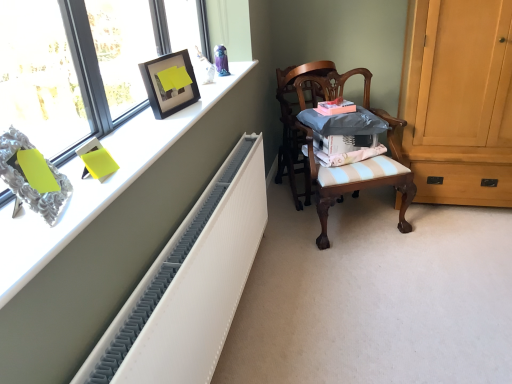
I want to click on matte glass window at upper left, so click(x=108, y=58).

This screenshot has height=384, width=512. What are the coordinates of `wooden chair at center, the 1th chair from the back` in the screenshot? It's located at (305, 108).

You are a GUI agent. You are given a task and a screenshot of the screen. Output one action in this format:
    pyautogui.click(x=<x>, y=<y>)
    Task: Click on the matte glass window at upper left
    
    Given the screenshot: What is the action you would take?
    (x=108, y=58)

Is matte black picture frame at upper left taller than wooden chair at center, placed as the 1th chair when sorted from front to back?

No.

Which object is closer to the camera, matte black picture frame at upper left or wooden chair at center, placed as the 1th chair when sorted from front to back?

matte black picture frame at upper left is in front.

Is matte black picture frame at upper left oriented away from wooden chair at center, placed as the 2th chair when sorted from back to front?

No, matte black picture frame at upper left is not facing away from wooden chair at center, placed as the 2th chair when sorted from back to front.

Considering the relative positions of matte black picture frame at upper left and wooden chair at center, placed as the 1th chair when sorted from front to back, in the image provided, is matte black picture frame at upper left to the right of wooden chair at center, placed as the 1th chair when sorted from front to back, from the viewer's perspective?

No.

Is white textured radiator at left smaller than light brown wood cabinet at right?

Yes, white textured radiator at left is smaller than light brown wood cabinet at right.

Between white textured radiator at left and light brown wood cabinet at right, which one appears on the right side from the viewer's perspective?

From the viewer's perspective, light brown wood cabinet at right appears more on the right side.

In the scene shown: Which object is closer to the camera, white textured radiator at left or light brown wood cabinet at right?

white textured radiator at left is more forward.

Looking at this image, from a real-world perspective, is white textured radiator at left positioned over light brown wood cabinet at right based on gravity?

Incorrect, from a real-world perspective, white textured radiator at left is lower than light brown wood cabinet at right.

In terms of height, does white textured radiator at left look taller or shorter compared to matte black picture frame at upper left?

Answer: Clearly, white textured radiator at left is taller compared to matte black picture frame at upper left.

Is white textured radiator at left oriented towards matte black picture frame at upper left?

No, white textured radiator at left is not aimed at matte black picture frame at upper left.

The height and width of the screenshot is (384, 512). Find the location of `picture frame on the left of white textured radiator at left`. picture frame on the left of white textured radiator at left is located at coordinates (170, 83).

Would you say white textured radiator at left is outside matte black picture frame at upper left?

Absolutely, white textured radiator at left is external to matte black picture frame at upper left.

From a real-world perspective, does matte glass window at upper left stand above wooden chair at center, the 1th chair from the back?

Indeed, from a real-world perspective, matte glass window at upper left stands above wooden chair at center, the 1th chair from the back.

Considering the sizes of objects matte glass window at upper left and wooden chair at center, the 1th chair from the back, in the image provided, who is taller, matte glass window at upper left or wooden chair at center, the 1th chair from the back,?

With more height is wooden chair at center, the 1th chair from the back.

Could you tell me if matte glass window at upper left is turned towards wooden chair at center, the 1th chair from the back?

No, matte glass window at upper left is not oriented towards wooden chair at center, the 1th chair from the back.

Is wooden chair at center, placed as the 2th chair when sorted from back to front, at the left side of white textured radiator at upper left?

No.

From the image's perspective, would you say wooden chair at center, placed as the 2th chair when sorted from back to front, is positioned over white textured radiator at upper left?

Incorrect, from the image's perspective, wooden chair at center, placed as the 2th chair when sorted from back to front, is lower than white textured radiator at upper left.

Does point (410, 199) come closer to viewer compared to point (131, 134)?

No, it is not.

From the picture: Could you tell me if matte glass window at upper left is facing white textured radiator at upper left?

Yes, matte glass window at upper left is facing white textured radiator at upper left.

Is matte glass window at upper left positioned in front of white textured radiator at upper left?

No, it is behind white textured radiator at upper left.

In order to click on desk that appears in front of the matte glass window at upper left in this screenshot , I will do 97,186.

Does matte glass window at upper left have a lesser width compared to white textured radiator at upper left?

Yes.

Can you confirm if light brown wood cabinet at right is smaller than white textured radiator at left?

No, light brown wood cabinet at right is not smaller than white textured radiator at left.

Can you confirm if light brown wood cabinet at right is shorter than white textured radiator at left?

In fact, light brown wood cabinet at right may be taller than white textured radiator at left.

Measure the distance from light brown wood cabinet at right to white textured radiator at left.

light brown wood cabinet at right and white textured radiator at left are 4.84 feet apart.

What's the angular difference between light brown wood cabinet at right and white textured radiator at left's facing directions?

The angular difference between light brown wood cabinet at right and white textured radiator at left is 89.6 degrees.

Locate an element on the screen. The height and width of the screenshot is (384, 512). picture frame that is on the left side of wooden chair at center, placed as the 1th chair when sorted from front to back is located at coordinates (170, 83).

At what (x,y) coordinates should I click in order to perform the action: click on cabinetry on the right side of white textured radiator at left. Please return your answer as a coordinate pair (x, y). The width and height of the screenshot is (512, 384). Looking at the image, I should click on (459, 101).

When comparing their distances from wooden chair at center, the 1th chair from the back, does light brown wood cabinet at right or wooden chair at center, placed as the 1th chair when sorted from front to back, seem closer?

Based on the image, wooden chair at center, placed as the 1th chair when sorted from front to back, appears to be nearer to wooden chair at center, the 1th chair from the back.

Looking at the image, which one is located closer to matte black picture frame at upper left, wooden chair at center, placed as the 1th chair when sorted from front to back, or matte glass window at upper left?

matte glass window at upper left lies closer to matte black picture frame at upper left than the other object.

When comparing their distances from light brown wood cabinet at right, does wooden chair at center, marked as the second chair in a front-to-back arrangement, or wooden chair at center, placed as the 2th chair when sorted from back to front, seem further?

The object further to light brown wood cabinet at right is wooden chair at center, marked as the second chair in a front-to-back arrangement.

Based on their spatial positions, is wooden chair at center, the 1th chair from the back, or matte glass window at upper left further from matte black picture frame at upper left?

wooden chair at center, the 1th chair from the back, is further to matte black picture frame at upper left.

When comparing their distances from light brown wood cabinet at right, does wooden chair at center, marked as the second chair in a front-to-back arrangement, or matte glass window at upper left seem further?

Based on the image, matte glass window at upper left appears to be further to light brown wood cabinet at right.

Estimate the real-world distances between objects in this image. Which object is closer to wooden chair at center, the 1th chair from the back, wooden chair at center, placed as the 2th chair when sorted from back to front, or light brown wood cabinet at right?

wooden chair at center, placed as the 2th chair when sorted from back to front, is positioned closer to the anchor wooden chair at center, the 1th chair from the back.

Considering their positions, is white textured radiator at upper left positioned further to matte glass window at upper left than light brown wood cabinet at right?

Based on the image, light brown wood cabinet at right appears to be further to matte glass window at upper left.

Considering their positions, is light brown wood cabinet at right positioned further to wooden chair at center, marked as the second chair in a front-to-back arrangement, than matte black picture frame at upper left?

matte black picture frame at upper left lies further to wooden chair at center, marked as the second chair in a front-to-back arrangement, than the other object.

Find the location of a particular element. The height and width of the screenshot is (384, 512). chair located between white textured radiator at upper left and wooden chair at center, the 1th chair from the back, in the depth direction is located at coordinates (356, 163).

The image size is (512, 384). Identify the location of radiator positioned between white textured radiator at upper left and wooden chair at center, marked as the second chair in a front-to-back arrangement, from near to far. (190, 284).

Locate an element on the screen. This screenshot has height=384, width=512. picture frame between matte glass window at upper left and wooden chair at center, placed as the 1th chair when sorted from front to back, along the z-axis is located at coordinates (170, 83).

You are a GUI agent. You are given a task and a screenshot of the screen. Output one action in this format:
    pyautogui.click(x=<x>, y=<y>)
    Task: Click on the chair located between matte glass window at upper left and wooden chair at center, the 1th chair from the back, in the depth direction
    The height and width of the screenshot is (384, 512).
    Given the screenshot: What is the action you would take?
    pyautogui.click(x=356, y=163)